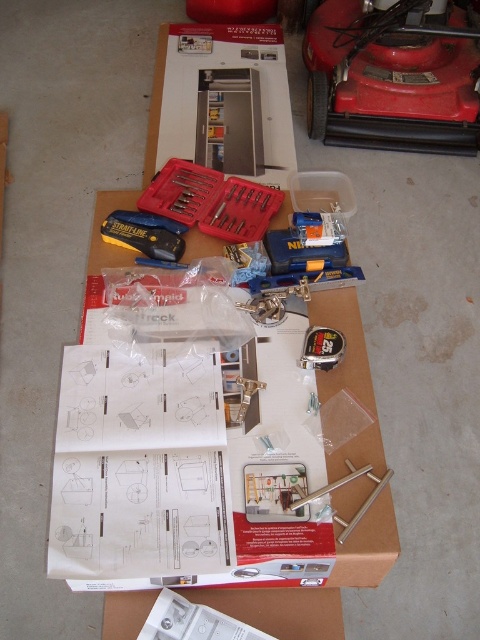
Question: Is the position of brown cardboard box at center less distant than that of matte black tool at center?

Choices:
 (A) yes
 (B) no

Answer: (A)

Question: Which object is farther from the camera taking this photo?

Choices:
 (A) brown cardboard box at center
 (B) satin nickel cabinet handle at center

Answer: (B)

Question: Which of the following is the farthest from the observer?

Choices:
 (A) matte black tool at center
 (B) brown cardboard box at center
 (C) satin nickel cabinet handle at center

Answer: (A)

Question: Can you confirm if brown cardboard box at center is positioned to the right of matte black tool at center?

Choices:
 (A) no
 (B) yes

Answer: (B)

Question: Is brown cardboard box at center thinner than satin nickel cabinet handle at center?

Choices:
 (A) no
 (B) yes

Answer: (A)

Question: Which point appears closest to the camera in this image?

Choices:
 (A) (123, 221)
 (B) (300, 628)

Answer: (B)